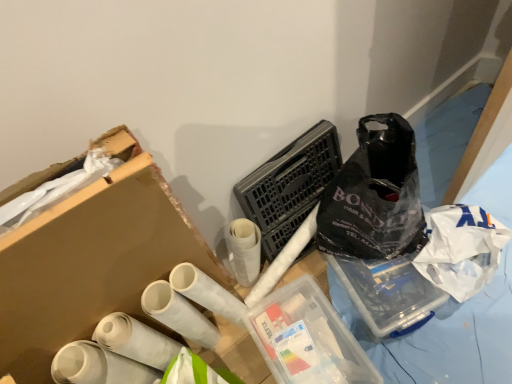
Question: Is white matte toilet paper at lower left, the 2th toilet paper from the left, wider or thinner than black plastic laundry basket at center?

Choices:
 (A) thin
 (B) wide

Answer: (A)

Question: From a real-world perspective, is white matte toilet paper at lower left, which appears as the second toilet paper when viewed from the right, above or below black plastic laundry basket at center?

Choices:
 (A) below
 (B) above

Answer: (A)

Question: Which of these objects is positioned closest to the white glossy toilet paper at center, which appears as the first toilet paper when viewed from the right?

Choices:
 (A) black plastic laundry basket at center
 (B) white matte toilet paper at lower left, positioned as the first toilet paper in left-to-right order
 (C) transparent plastic container at center
 (D) white matte toilet paper at lower left, the 2th toilet paper from the left

Answer: (D)

Question: Based on their relative distances, which object is farther from the transparent plastic container at center?

Choices:
 (A) white matte toilet paper at lower left, the 2th toilet paper from the left
 (B) black plastic laundry basket at center
 (C) white glossy toilet paper at center, which appears as the first toilet paper when viewed from the right
 (D) white matte toilet paper at lower left, positioned as the first toilet paper in left-to-right order

Answer: (D)